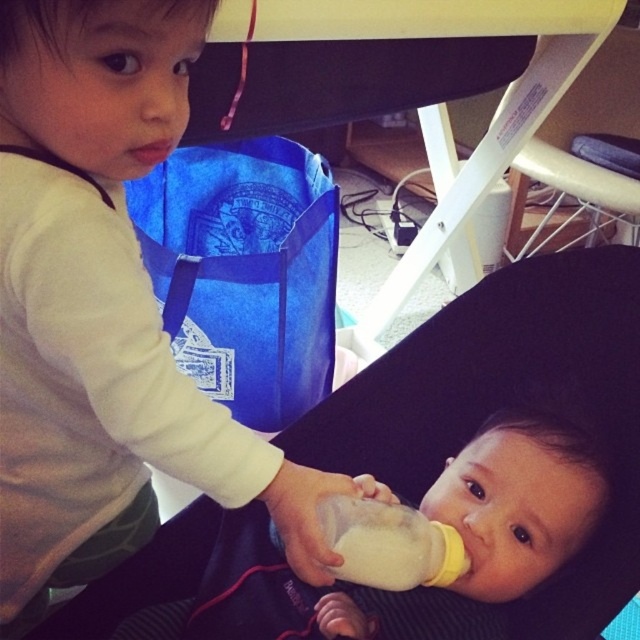
Question: Which of the following is the closest to the observer?

Choices:
 (A) (428, 573)
 (B) (467, 449)
 (C) (160, 376)

Answer: (C)

Question: Which point is farther to the camera?

Choices:
 (A) (148, 80)
 (B) (344, 573)

Answer: (B)

Question: Where is white matte baby bottle at lower center located in relation to white matte bottle at center in the image?

Choices:
 (A) above
 (B) below

Answer: (A)

Question: Considering the relative positions of white matte baby bottle at lower center and white matte bottle at center in the image provided, where is white matte baby bottle at lower center located with respect to white matte bottle at center?

Choices:
 (A) above
 (B) below

Answer: (A)

Question: Which point is farther from the camera taking this photo?

Choices:
 (A) (364, 637)
 (B) (410, 522)
 (C) (163, 410)

Answer: (A)

Question: Is white matte baby bottle at lower center below smooth plastic bottle at center?

Choices:
 (A) no
 (B) yes

Answer: (A)